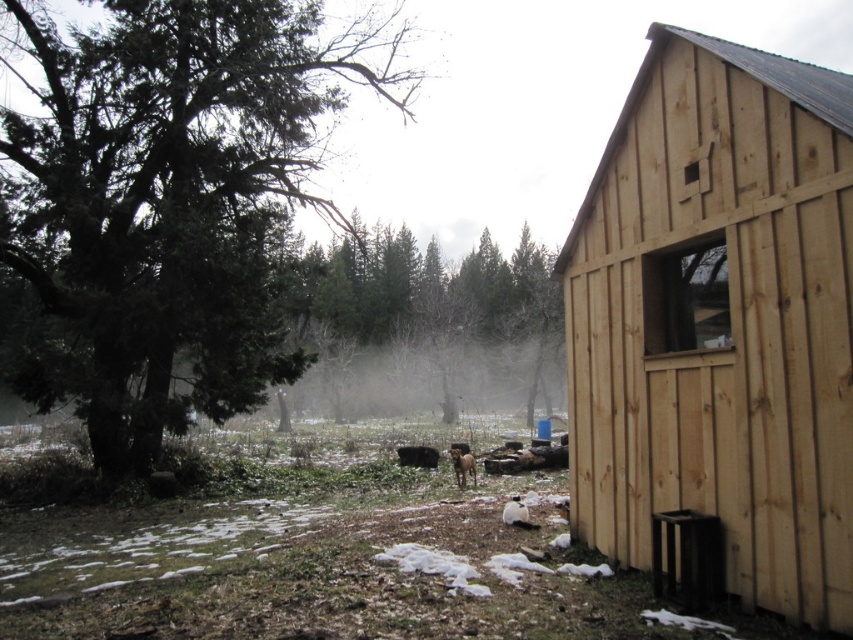
In the scene shown: Can you confirm if green textured tree at left is positioned above green matte tree at center?

Yes, green textured tree at left is above green matte tree at center.

Does green textured tree at left have a lesser height compared to green matte tree at center?

No, green textured tree at left is not shorter than green matte tree at center.

Does point (212, 26) lie behind point (526, 307)?

No, (212, 26) is closer to viewer.

Locate an element on the screen. The height and width of the screenshot is (640, 853). green textured tree at left is located at coordinates [165, 204].

In the scene shown: How distant is natural wood cabin at right from green matte tree at center?

natural wood cabin at right is 36.51 meters away from green matte tree at center.

Which is behind, point (808, 92) or point (503, 339)?

The point (503, 339) is more distant.

This screenshot has width=853, height=640. What do you see at coordinates (718, 321) in the screenshot?
I see `natural wood cabin at right` at bounding box center [718, 321].

This screenshot has height=640, width=853. I want to click on natural wood cabin at right, so click(x=718, y=321).

Can you confirm if natural wood cabin at right is positioned below green textured tree at left?

Yes.

I want to click on natural wood cabin at right, so (718, 321).